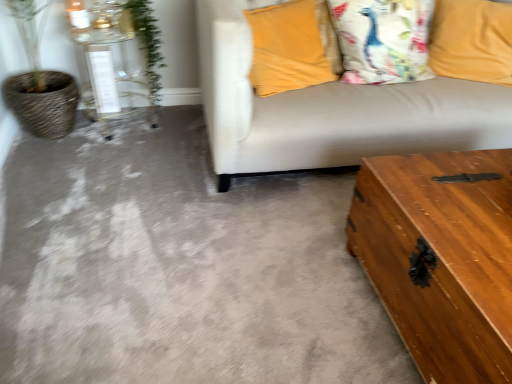
Question: Looking at their shapes, would you say white cotton pillow at upper right, the 2th pillow positioned from the right, is wider or thinner than green leafy plant at upper left?

Choices:
 (A) wide
 (B) thin

Answer: (A)

Question: Is white cotton pillow at upper right, the second pillow viewed from the left, inside or outside of green leafy plant at upper left?

Choices:
 (A) inside
 (B) outside

Answer: (B)

Question: Which of these objects is positioned closest to the white cotton pillow at upper right, the 2th pillow positioned from the right?

Choices:
 (A) wooden trunk at lower right, acting as the 2th table starting from the top
 (B) wooden trunk at lower right
 (C) green leafy plant at upper left
 (D) yellow fabric pillow at upper right, the first pillow from the right
 (E) clear glass table at left, which appears as the first table when viewed from the top

Answer: (D)

Question: Estimate the real-world distances between objects in this image. Which object is closer to the velvet yellow pillow at upper right, the 1th pillow in the left-to-right sequence?

Choices:
 (A) wooden trunk at lower right
 (B) yellow fabric pillow at upper right, the first pillow from the right
 (C) clear glass table at left, the second table from the front
 (D) wooden trunk at lower right, the 2th table in the left-to-right sequence
 (E) green leafy plant at upper left

Answer: (B)